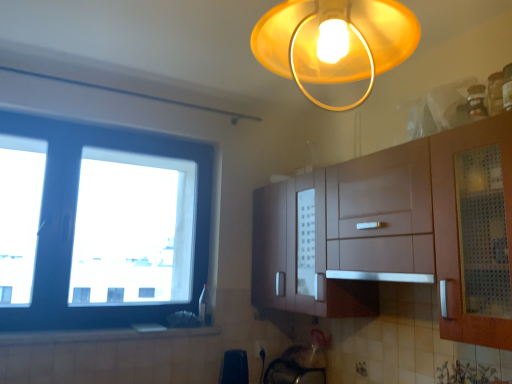
Question: Is white glossy countertop at lower left facing away from satin silver exhaust hood at center?

Choices:
 (A) no
 (B) yes

Answer: (A)

Question: Is white glossy countertop at lower left positioned beyond the bounds of satin silver exhaust hood at center?

Choices:
 (A) yes
 (B) no

Answer: (A)

Question: Does white glossy countertop at lower left have a smaller size compared to satin silver exhaust hood at center?

Choices:
 (A) no
 (B) yes

Answer: (B)

Question: Is white glossy countertop at lower left further to the viewer compared to satin silver exhaust hood at center?

Choices:
 (A) yes
 (B) no

Answer: (A)

Question: Considering the relative sizes of white glossy countertop at lower left and satin silver exhaust hood at center in the image provided, is white glossy countertop at lower left wider than satin silver exhaust hood at center?

Choices:
 (A) yes
 (B) no

Answer: (B)

Question: From the image's perspective, is white glossy countertop at lower left under satin silver exhaust hood at center?

Choices:
 (A) no
 (B) yes

Answer: (B)

Question: Is white glossy countertop at lower left positioned far away from white glossy electric outlet at lower center?

Choices:
 (A) yes
 (B) no

Answer: (B)

Question: Is white glossy countertop at lower left bigger than white glossy electric outlet at lower center?

Choices:
 (A) no
 (B) yes

Answer: (B)

Question: From a real-world perspective, is white glossy countertop at lower left beneath white glossy electric outlet at lower center?

Choices:
 (A) no
 (B) yes

Answer: (A)

Question: Does white glossy countertop at lower left have a greater height compared to white glossy electric outlet at lower center?

Choices:
 (A) no
 (B) yes

Answer: (A)

Question: Is white glossy electric outlet at lower center located within white glossy countertop at lower left?

Choices:
 (A) yes
 (B) no

Answer: (B)

Question: Is white glossy countertop at lower left next to white glossy electric outlet at lower center and touching it?

Choices:
 (A) no
 (B) yes

Answer: (A)

Question: Is white glossy electric outlet at lower center at the left side of black plastic bag at lower center?

Choices:
 (A) no
 (B) yes

Answer: (A)